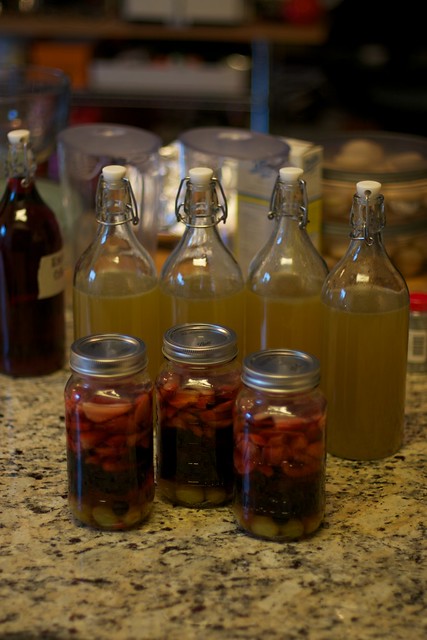
This screenshot has width=427, height=640. I want to click on counter, so click(x=245, y=605).